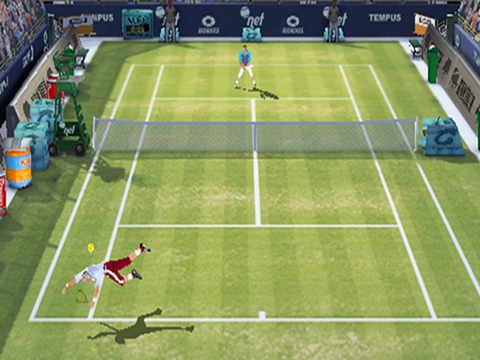
Where is `stands`? stands is located at coordinates (472, 23).